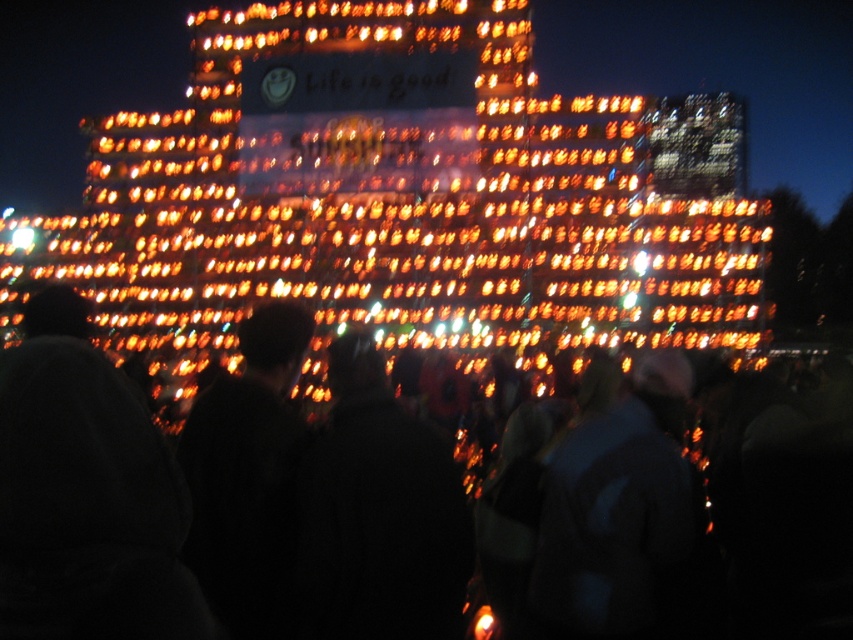
Is black fuzzy hat at lower left behind black matte jacket at center?

That is False.

Does black fuzzy hat at lower left have a larger size compared to black matte jacket at center?

Indeed, black fuzzy hat at lower left has a larger size compared to black matte jacket at center.

Image resolution: width=853 pixels, height=640 pixels. What do you see at coordinates (86, 493) in the screenshot? I see `black fuzzy hat at lower left` at bounding box center [86, 493].

Find the location of `black fuzzy hat at lower left`. black fuzzy hat at lower left is located at coordinates (86, 493).

Is black fuzzy hat at lower left thinner than dark blue jacket at center?

No.

Does black fuzzy hat at lower left have a larger size compared to dark blue jacket at center?

Indeed, black fuzzy hat at lower left has a larger size compared to dark blue jacket at center.

Does point (1, 483) come farther from viewer compared to point (682, 413)?

No, (1, 483) is in front of (682, 413).

The width and height of the screenshot is (853, 640). What are the coordinates of `black fuzzy hat at lower left` in the screenshot? It's located at (86, 493).

What do you see at coordinates (376, 515) in the screenshot? The image size is (853, 640). I see `black matte jacket at center` at bounding box center [376, 515].

In the scene shown: Is black matte jacket at center below dark blue jacket at center?

No.

Is point (412, 488) farther from viewer compared to point (613, 413)?

That is False.

Where is `black matte jacket at center`? Image resolution: width=853 pixels, height=640 pixels. black matte jacket at center is located at coordinates (376, 515).